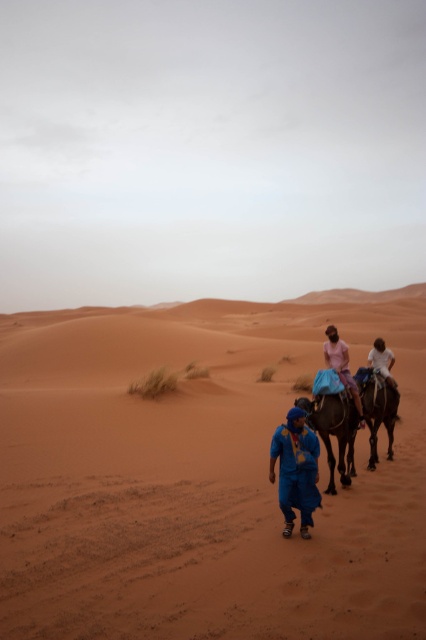
Question: Among these objects, which one is nearest to the camera?

Choices:
 (A) white matte shirt at center
 (B) blue fabric at center

Answer: (B)

Question: Which point is closer to the camera?

Choices:
 (A) brown textured camel at center
 (B) white matte shirt at center
 (C) brown textured camel at center-right

Answer: (A)

Question: Does brown textured camel at center have a lesser width compared to light pink fabric at center?

Choices:
 (A) yes
 (B) no

Answer: (B)

Question: Does light pink fabric at center appear over white matte shirt at center?

Choices:
 (A) yes
 (B) no

Answer: (A)

Question: Considering the real-world distances, which object is closest to the brown textured camel at center-right?

Choices:
 (A) light pink fabric at center
 (B) smooth sand at center
 (C) brown textured camel at center
 (D) white matte shirt at center

Answer: (D)

Question: Where is smooth sand at center located in relation to light pink fabric at center in the image?

Choices:
 (A) below
 (B) above

Answer: (A)